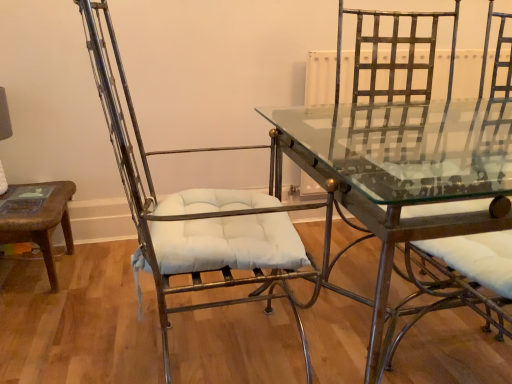
Question: Does clear glass table at center come behind metallic gold swivel chair at right?

Choices:
 (A) no
 (B) yes

Answer: (B)

Question: From the image's perspective, is clear glass table at center on metallic gold swivel chair at right?

Choices:
 (A) yes
 (B) no

Answer: (B)

Question: Can you confirm if clear glass table at center is positioned to the left of metallic gold swivel chair at right?

Choices:
 (A) yes
 (B) no

Answer: (A)

Question: Considering the relative sizes of clear glass table at center and metallic gold swivel chair at right in the image provided, is clear glass table at center thinner than metallic gold swivel chair at right?

Choices:
 (A) no
 (B) yes

Answer: (A)

Question: Is clear glass table at center completely or partially outside of metallic gold swivel chair at right?

Choices:
 (A) yes
 (B) no

Answer: (A)

Question: Looking at their shapes, would you say metallic wire chair at left is wider or thinner than clear glass table at center?

Choices:
 (A) wide
 (B) thin

Answer: (B)

Question: Based on their sizes in the image, would you say metallic wire chair at left is bigger or smaller than clear glass table at center?

Choices:
 (A) small
 (B) big

Answer: (A)

Question: Do you think metallic wire chair at left is within clear glass table at center, or outside of it?

Choices:
 (A) outside
 (B) inside

Answer: (A)

Question: Considering the relative positions of metallic wire chair at left and clear glass table at center in the image provided, is metallic wire chair at left to the left or to the right of clear glass table at center?

Choices:
 (A) right
 (B) left

Answer: (B)

Question: Considering the positions of point (159, 203) and point (435, 307), is point (159, 203) closer or farther from the camera than point (435, 307)?

Choices:
 (A) closer
 (B) farther

Answer: (A)

Question: Relative to metallic gold swivel chair at right, is metallic wire chair at left in front or behind?

Choices:
 (A) front
 (B) behind

Answer: (B)

Question: Choose the correct answer: Is metallic wire chair at left inside metallic gold swivel chair at right or outside it?

Choices:
 (A) outside
 (B) inside

Answer: (A)

Question: In terms of width, does metallic wire chair at left look wider or thinner when compared to metallic gold swivel chair at right?

Choices:
 (A) thin
 (B) wide

Answer: (B)

Question: From the image's perspective, is clear glass table at center above or below metallic wire chair at left?

Choices:
 (A) below
 (B) above

Answer: (A)

Question: In terms of height, does clear glass table at center look taller or shorter compared to metallic wire chair at left?

Choices:
 (A) tall
 (B) short

Answer: (B)